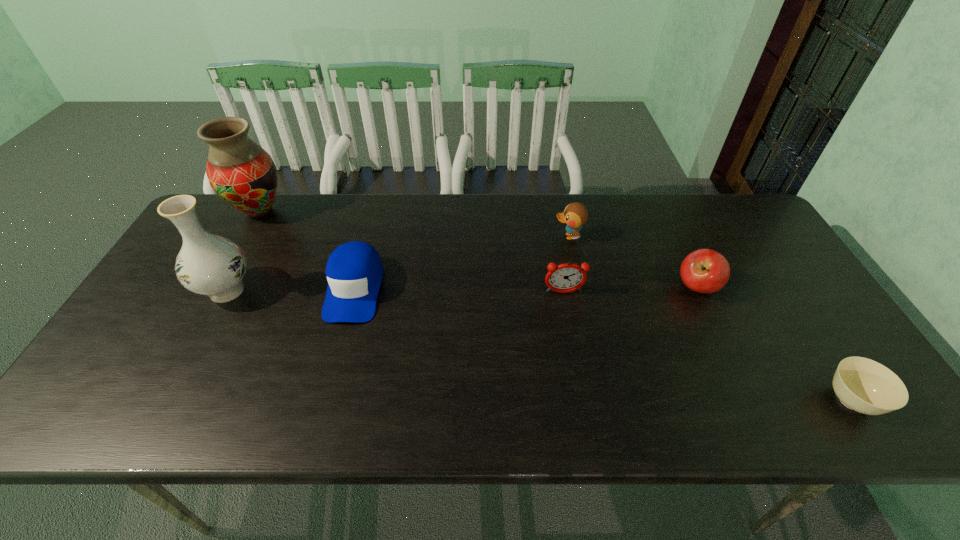
Locate an element on the screen. Image resolution: width=960 pixels, height=540 pixels. free spot between the nearer vase and the alarm clock is located at coordinates (396, 292).

You are a GUI agent. You are given a task and a screenshot of the screen. Output one action in this format:
    pyautogui.click(x=<x>, y=<y>)
    Task: Click on the free space between the duck and the fifth object from right to left
    
    Given the screenshot: What is the action you would take?
    pyautogui.click(x=462, y=262)

Find the location of a particular element. The image size is (960, 540). vacant point located between the baseball cap and the sugar bowl is located at coordinates (603, 345).

Identify the location of vacant region between the nearest object and the duck. This screenshot has width=960, height=540. (709, 319).

Image resolution: width=960 pixels, height=540 pixels. I want to click on vacant space that is in between the nearest object and the nearer vase, so click(x=539, y=346).

This screenshot has width=960, height=540. Identify the location of vacant space that is in between the alarm clock and the baseball cap. (459, 291).

The image size is (960, 540). Find the location of `free point between the duck and the sugar bowl`. free point between the duck and the sugar bowl is located at coordinates (709, 319).

Locate an element on the screen. The height and width of the screenshot is (540, 960). vacant region between the shortest object and the alarm clock is located at coordinates (708, 347).

The height and width of the screenshot is (540, 960). I want to click on blank region between the rightmost object and the farther vase, so click(x=555, y=306).

Select which object is the sixth closest to the apple. Please provide its 2D coordinates. Your answer should be formatted as a tuple, i.e. [(x, y)], where the tuple contains the x and y coordinates of a point satisfying the conditions above.

[(243, 174)]